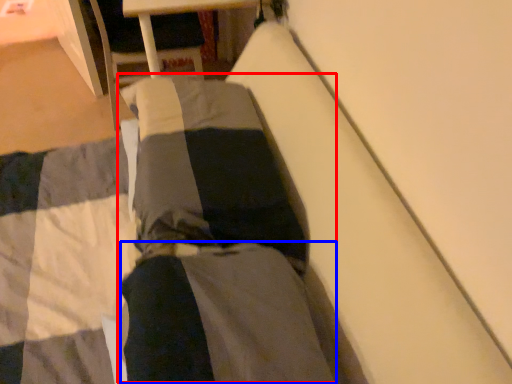
Question: Which of the following is the closest to the observer, couple (highlighted by a red box) or pants (highlighted by a blue box)?

Choices:
 (A) couple
 (B) pants

Answer: (B)